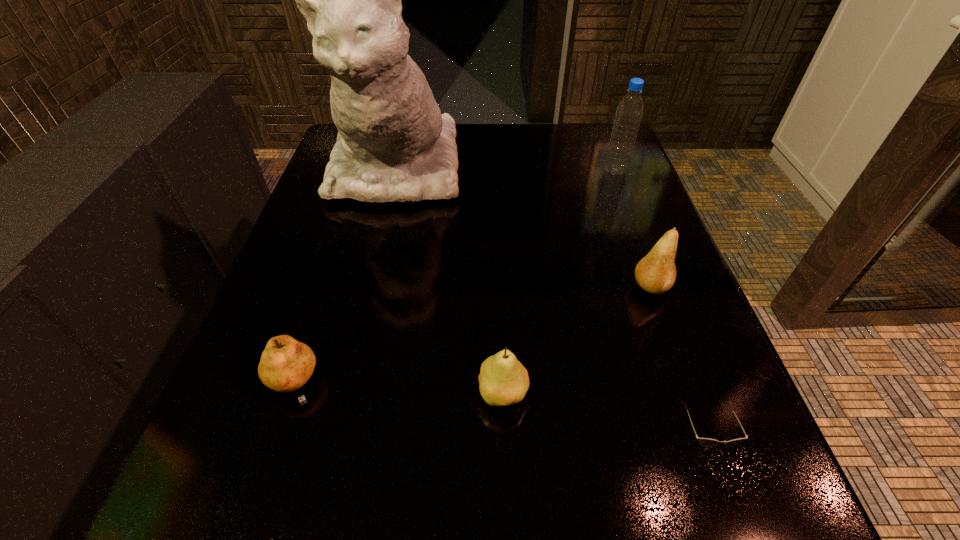
Locate an element on the screen. The image size is (960, 540). vacant space that is in between the second tallest object and the second pear from right to left is located at coordinates 559,283.

Identify the location of free spot between the second tallest object and the tallest object. The width and height of the screenshot is (960, 540). (506, 169).

Identify the location of unoccupied area between the farthest pear and the cat. The height and width of the screenshot is (540, 960). (523, 227).

Identify the location of vacant space in between the cat and the fourth nearest object. The height and width of the screenshot is (540, 960). (523, 227).

Find the location of a particular element. The width and height of the screenshot is (960, 540). free space between the fifth shortest object and the shortest pear is located at coordinates (454, 279).

This screenshot has width=960, height=540. I want to click on free spot between the water bottle and the sunglasses, so click(x=658, y=305).

Identify the location of vacant space in between the third object from left to right and the farthest pear. The height and width of the screenshot is (540, 960). (577, 341).

Locate an element on the screen. free point between the cat and the fifth shortest object is located at coordinates (506, 169).

What are the coordinates of `vacant area between the fifth shortest object and the cat` in the screenshot? It's located at (506, 169).

Point out which object is positioned as the fifth nearest to the second tallest object. Please provide its 2D coordinates. Your answer should be formatted as a tuple, i.e. [(x, y)], where the tuple contains the x and y coordinates of a point satisfying the conditions above.

[(286, 365)]